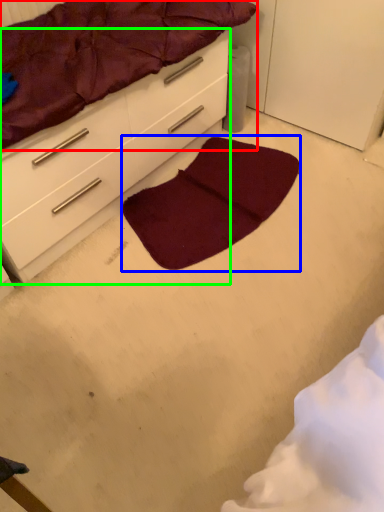
Question: Which object is positioned farthest from mattress (highlighted by a red box)? Select from mat (highlighted by a blue box) and chest of drawers (highlighted by a green box).

Choices:
 (A) mat
 (B) chest of drawers

Answer: (A)